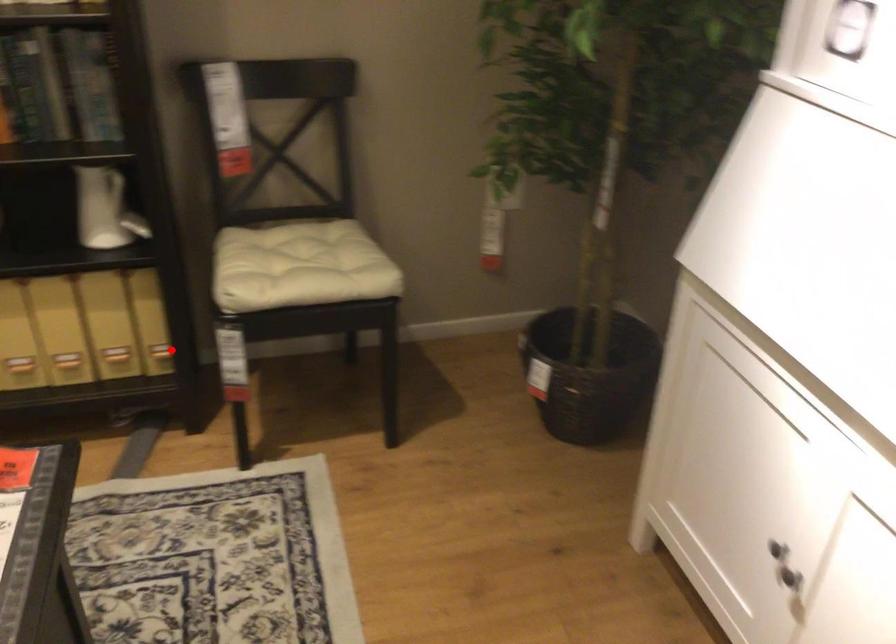
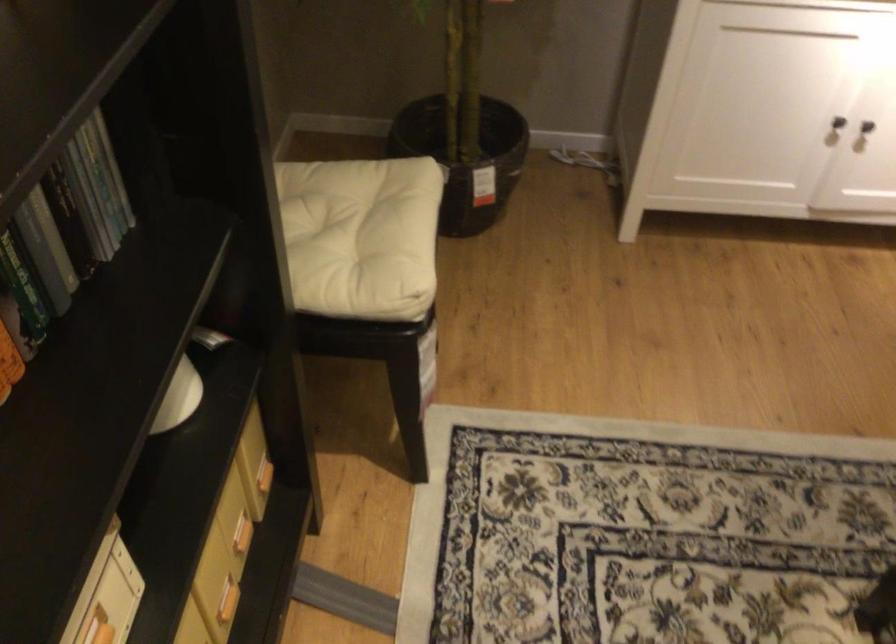
Question: I am providing you with two images of the same scene from different viewpoints. Image1 has a red point marked. In image2, the corresponding 3D location appears at what relative position? Reply with the corresponding letter.

Choices:
 (A) Closer
 (B) Farther

Answer: (A)